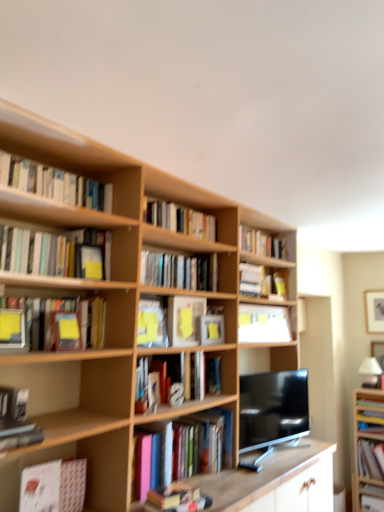
This screenshot has width=384, height=512. I want to click on free point above matte pink book at lower left, which is counted as the 4th book, starting from the bottom (from a real-world perspective), so click(x=54, y=454).